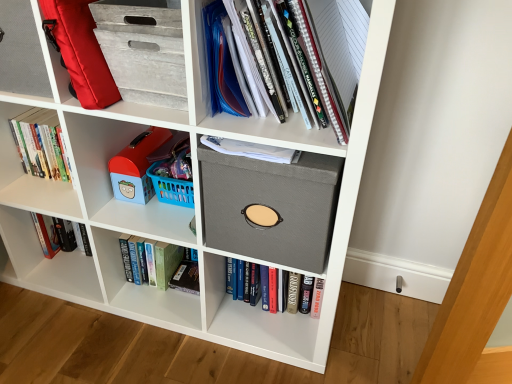
Locate an element on the screen. This screenshot has width=512, height=384. blue plastic toy at center-left is located at coordinates (136, 166).

The image size is (512, 384). Describe the element at coordinates (41, 144) in the screenshot. I see `hardcover book at left, positioned as the first book in top-to-bottom order` at that location.

What is the approximate width of hardcover book at center, which is the 3th book from top to bottom?

The width of hardcover book at center, which is the 3th book from top to bottom, is 2.57 inches.

Describe the element at coordinates (319, 58) in the screenshot. I see `matte gray folder at upper right, placed as the 2th shelf when sorted from left to right` at that location.

Find the location of a particular element. blue plastic toy at center-left is located at coordinates (136, 166).

This screenshot has height=384, width=512. I want to click on the 1st book above when counting from the hardcover book at center, marked as the first book in a right-to-left arrangement (from the image's perspective), so click(150, 260).

Is hardcover book at lower left, which is the 2th book from bottom to top, oriented towards hardcover book at center, which is the 3th book from top to bottom?

No, hardcover book at lower left, which is the 2th book from bottom to top, is not facing towards hardcover book at center, which is the 3th book from top to bottom.

Can you see hardcover book at lower left, arranged as the second book when viewed from the top, touching hardcover book at center, placed as the 1th book when sorted from bottom to top?

No, hardcover book at lower left, arranged as the second book when viewed from the top, is not with hardcover book at center, placed as the 1th book when sorted from bottom to top.

In the image, is hardcover book at lower left, arranged as the second book when viewed from the top, positioned in front of or behind hardcover book at center, which is the 3th book from top to bottom?

In the image, hardcover book at lower left, arranged as the second book when viewed from the top, appears behind hardcover book at center, which is the 3th book from top to bottom.

Considering the relative positions of gray textured storage bin at upper left and matte plastic toy at left, the first shelf from the left, in the image provided, is gray textured storage bin at upper left to the right of matte plastic toy at left, the first shelf from the left, from the viewer's perspective?

Yes.

Is gray textured storage bin at upper left oriented towards matte plastic toy at left, which ranks as the second shelf in right-to-left order?

No, gray textured storage bin at upper left is not aimed at matte plastic toy at left, which ranks as the second shelf in right-to-left order.

Would you consider gray textured storage bin at upper left to be distant from matte plastic toy at left, which ranks as the second shelf in right-to-left order?

No, there isn't a large distance between gray textured storage bin at upper left and matte plastic toy at left, which ranks as the second shelf in right-to-left order.

Considering the sizes of objects gray textured storage bin at upper left and matte plastic toy at left, the first shelf from the left, in the image provided, who is smaller, gray textured storage bin at upper left or matte plastic toy at left, the first shelf from the left,?

matte plastic toy at left, the first shelf from the left, is smaller.

Is blue plastic toy at center-left turned away from hardcover book at left, positioned as the first book in top-to-bottom order?

No, blue plastic toy at center-left is not facing the opposite direction of hardcover book at left, positioned as the first book in top-to-bottom order.

How different are the orientations of blue plastic toy at center-left and hardcover book at left, the first book viewed from the left, in degrees?

blue plastic toy at center-left and hardcover book at left, the first book viewed from the left, are facing 1.6 degrees away from each other.

Is blue plastic toy at center-left located outside hardcover book at left, positioned as the first book in top-to-bottom order?

Indeed, blue plastic toy at center-left is completely outside hardcover book at left, positioned as the first book in top-to-bottom order.

Is blue plastic toy at center-left wider than hardcover book at left, which is counted as the 3th book, starting from the bottom?

Indeed, blue plastic toy at center-left has a greater width compared to hardcover book at left, which is counted as the 3th book, starting from the bottom.

Considering the positions of objects hardcover book at left, positioned as the 3th book in right-to-left order, and gray fabric storage box at center in the image provided, who is more to the right, hardcover book at left, positioned as the 3th book in right-to-left order, or gray fabric storage box at center?

From the viewer's perspective, gray fabric storage box at center appears more on the right side.

Considering the sizes of objects hardcover book at left, positioned as the first book in top-to-bottom order, and gray fabric storage box at center in the image provided, who is shorter, hardcover book at left, positioned as the first book in top-to-bottom order, or gray fabric storage box at center?

hardcover book at left, positioned as the first book in top-to-bottom order, is shorter.

Is hardcover book at left, positioned as the first book in top-to-bottom order, positioned with its back to gray fabric storage box at center?

No, hardcover book at left, positioned as the first book in top-to-bottom order, is not facing away from gray fabric storage box at center.

Can you tell me how much hardcover book at left, the first book viewed from the left, and gray fabric storage box at center differ in facing direction?

hardcover book at left, the first book viewed from the left, and gray fabric storage box at center are facing 2.22 degrees away from each other.

Who is taller, red fabric backpack at upper left or matte plastic toy at left, which is the 1th shelf in back-to-front order?

red fabric backpack at upper left.

Is red fabric backpack at upper left situated inside matte plastic toy at left, the first shelf from the left, or outside?

red fabric backpack at upper left is outside matte plastic toy at left, the first shelf from the left.

In the scene shown: How many degrees apart are the facing directions of red fabric backpack at upper left and matte plastic toy at left, which is the 1th shelf in back-to-front order?

The angle between the facing direction of red fabric backpack at upper left and the facing direction of matte plastic toy at left, which is the 1th shelf in back-to-front order, is 0.795 degrees.

Is red fabric backpack at upper left wider or thinner than matte plastic toy at left, which is the second shelf from front to back?

Considering their sizes, red fabric backpack at upper left looks broader than matte plastic toy at left, which is the second shelf from front to back.

What's the angular difference between blue plastic toy at center-left and hardcover book at lower left, arranged as the second book when viewed from the top,'s facing directions?

There is a 0.222-degree angle between the facing directions of blue plastic toy at center-left and hardcover book at lower left, arranged as the second book when viewed from the top.

Is blue plastic toy at center-left far from hardcover book at lower left, which is the 2th book from bottom to top?

blue plastic toy at center-left is actually quite close to hardcover book at lower left, which is the 2th book from bottom to top.

In terms of height, does blue plastic toy at center-left look taller or shorter compared to hardcover book at lower left, arranged as the second book when viewed from the top?

In the image, blue plastic toy at center-left appears to be shorter than hardcover book at lower left, arranged as the second book when viewed from the top.

Between blue plastic toy at center-left and hardcover book at lower left, which is counted as the 2th book, starting from the right, which one has larger size?

hardcover book at lower left, which is counted as the 2th book, starting from the right, is bigger.

How much distance is there between hardcover book at lower left, which is the 2th book from bottom to top, and matte plastic toy at left, which is the second shelf from front to back?

hardcover book at lower left, which is the 2th book from bottom to top, and matte plastic toy at left, which is the second shelf from front to back, are 33.13 centimeters apart.

From the image's perspective, which is below, hardcover book at lower left, which is the 2th book from bottom to top, or matte plastic toy at left, which is the 1th shelf in back-to-front order?

hardcover book at lower left, which is the 2th book from bottom to top, from the image's perspective.

Which is closer, (161, 270) or (54, 117)?

Point (161, 270).

Which is behind, hardcover book at lower left, which is counted as the 2th book, starting from the right, or matte plastic toy at left, which ranks as the second shelf in right-to-left order?

hardcover book at lower left, which is counted as the 2th book, starting from the right, is further away from the camera.

Locate an element on the screen. This screenshot has height=384, width=512. book below the hardcover book at lower left, which is the 2th book from bottom to top (from the image's perspective) is located at coordinates (261, 285).

Identify the location of cabinet located above the matte plastic toy at left, which is the 1th shelf in back-to-front order (from the image's perspective). The width and height of the screenshot is (512, 384). (143, 51).

Which object lies nearer to the anchor point matte gray folder at upper right, the 2th shelf from the back, matte plastic toy at left, the first shelf from the left, or gray fabric storage box at center?

gray fabric storage box at center is closer to matte gray folder at upper right, the 2th shelf from the back.

Considering their positions, is hardcover book at left, which is counted as the 3th book, starting from the bottom, positioned further to hardcover book at center, placed as the 3th book when sorted from left to right, than gray fabric storage box at center?

Based on the image, hardcover book at left, which is counted as the 3th book, starting from the bottom, appears to be further to hardcover book at center, placed as the 3th book when sorted from left to right.

Looking at the image, which one is located further to matte plastic toy at left, which is the second shelf from front to back, hardcover book at center, placed as the 1th book when sorted from bottom to top, or matte gray folder at upper right, which is the 1th shelf in right-to-left order?

matte gray folder at upper right, which is the 1th shelf in right-to-left order, is positioned further to the anchor matte plastic toy at left, which is the second shelf from front to back.

Considering their positions, is red fabric backpack at upper left positioned closer to matte plastic toy at left, the first shelf from the left, than gray fabric storage box at center?

red fabric backpack at upper left lies closer to matte plastic toy at left, the first shelf from the left, than the other object.

When comparing their distances from gray textured storage bin at upper left, does red fabric backpack at upper left or hardcover book at left, positioned as the 3th book in right-to-left order, seem closer?

red fabric backpack at upper left is positioned closer to the anchor gray textured storage bin at upper left.

Consider the image. When comparing their distances from matte plastic toy at left, which is the second shelf from front to back, does gray fabric storage box at center or gray textured storage bin at upper left seem further?

Among the two, gray fabric storage box at center is located further to matte plastic toy at left, which is the second shelf from front to back.

Based on their spatial positions, is hardcover book at lower left, which is counted as the 2th book, starting from the right, or blue plastic toy at center-left closer to gray textured storage bin at upper left?

Based on the image, blue plastic toy at center-left appears to be nearer to gray textured storage bin at upper left.

Based on their spatial positions, is red fabric backpack at upper left or matte plastic toy at left, which is the 1th shelf in back-to-front order, further from hardcover book at center, placed as the 1th book when sorted from bottom to top?

Among the two, red fabric backpack at upper left is located further to hardcover book at center, placed as the 1th book when sorted from bottom to top.

This screenshot has width=512, height=384. I want to click on toy between matte gray folder at upper right, placed as the 2th shelf when sorted from left to right, and hardcover book at center, placed as the 3th book when sorted from left to right, in the vertical direction, so click(x=136, y=166).

Where is `shelf situated between hardcover book at left, which is counted as the 3th book, starting from the bottom, and matte gray folder at upper right, the 2th shelf from the back, from left to right`? This screenshot has height=384, width=512. shelf situated between hardcover book at left, which is counted as the 3th book, starting from the bottom, and matte gray folder at upper right, the 2th shelf from the back, from left to right is located at coordinates (30, 179).

Where is `luggage between hardcover book at left, positioned as the first book in top-to-bottom order, and gray textured storage bin at upper left`? luggage between hardcover book at left, positioned as the first book in top-to-bottom order, and gray textured storage bin at upper left is located at coordinates (82, 52).

This screenshot has width=512, height=384. What are the coordinates of `book between matte plastic toy at left, the first shelf from the left, and hardcover book at center, which is the 3th book from top to bottom, in the horizontal direction` in the screenshot? It's located at (150, 260).